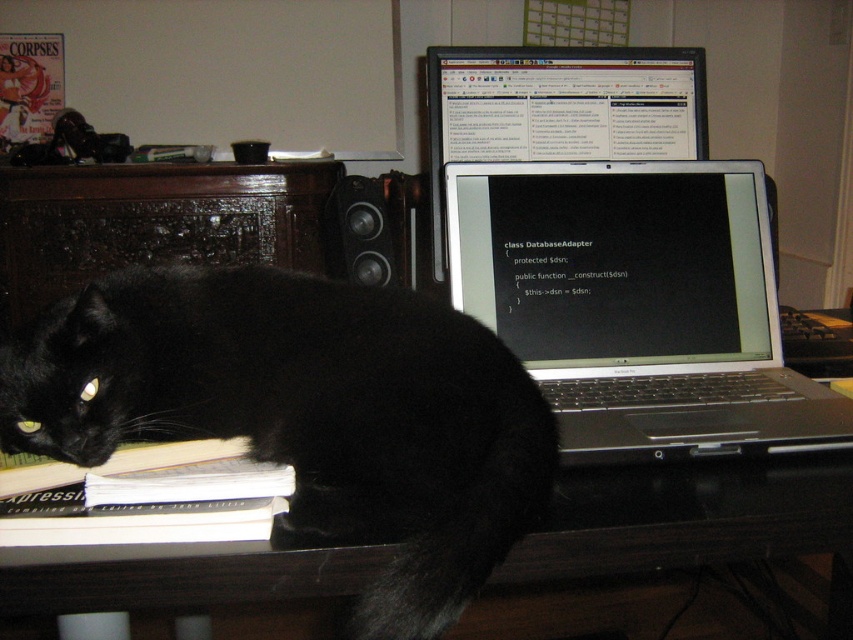
Question: Estimate the real-world distances between objects in this image. Which object is closer to the black wooden table at lower left?

Choices:
 (A) silver metallic laptop at center
 (B) black glossy laptop at upper center
 (C) white paper book at lower left

Answer: (C)

Question: Does silver metallic laptop at center appear under black glossy laptop at upper center?

Choices:
 (A) yes
 (B) no

Answer: (A)

Question: Which point appears farthest from the camera in this image?

Choices:
 (A) (402, 452)
 (B) (335, 604)
 (C) (80, 468)

Answer: (B)

Question: Is black wooden table at lower left closer to the viewer compared to black glossy laptop at upper center?

Choices:
 (A) yes
 (B) no

Answer: (A)

Question: Which of these objects is positioned farthest from the black glossy laptop at upper center?

Choices:
 (A) black wooden table at lower left
 (B) white paper book at lower left
 (C) black fur cat at left
 (D) silver metallic laptop at center

Answer: (B)

Question: Does silver metallic laptop at center have a lesser width compared to white paper book at lower left?

Choices:
 (A) yes
 (B) no

Answer: (B)